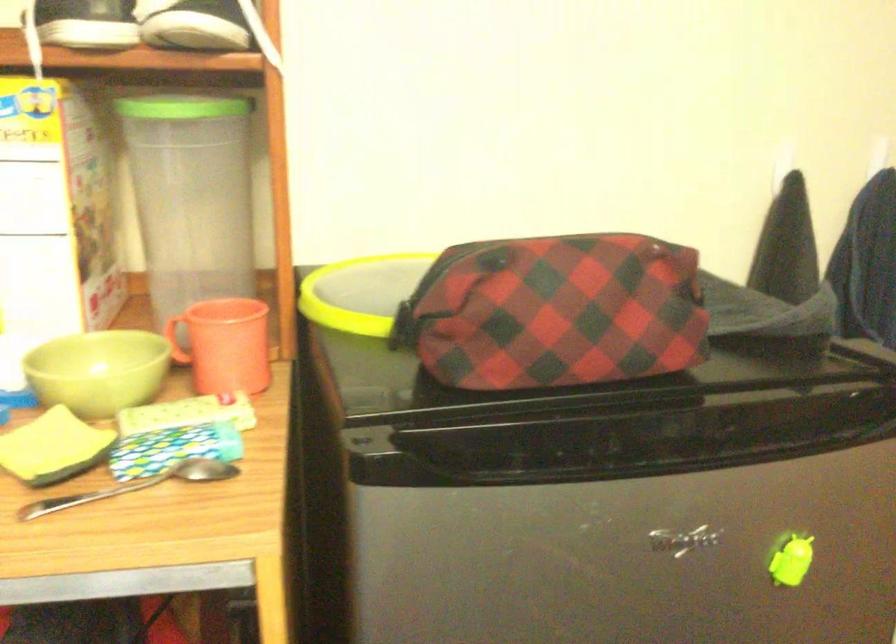
The width and height of the screenshot is (896, 644). Describe the element at coordinates (556, 430) in the screenshot. I see `the black refrigerator handle` at that location.